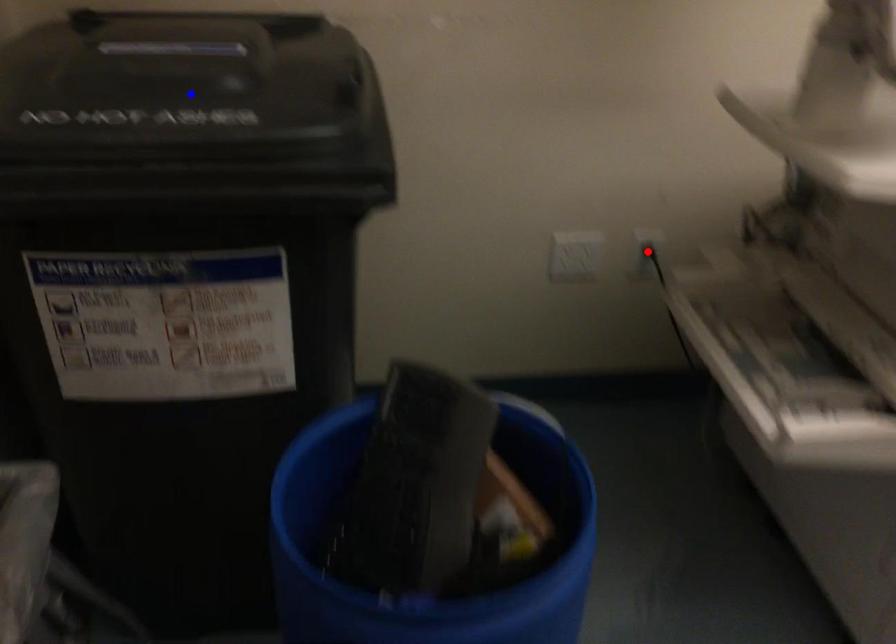
Question: Which of the two points in the image is closer to the camera?

Choices:
 (A) Blue point is closer.
 (B) Red point is closer.

Answer: (A)